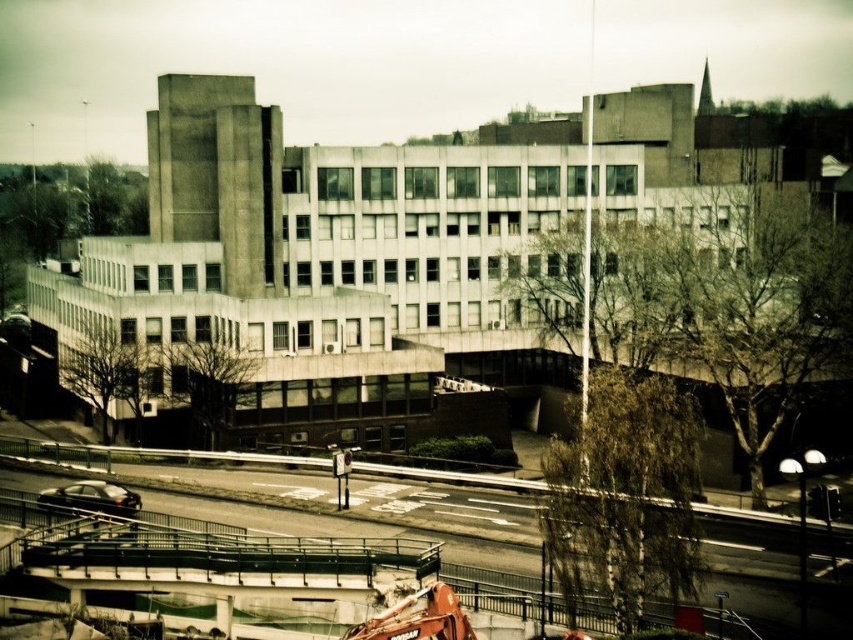
Can you confirm if concrete at center is thinner than orange metallic crane at center?

Incorrect, concrete at center's width is not less than orange metallic crane at center's.

Is concrete at center positioned behind orange metallic crane at center?

Yes, concrete at center is behind orange metallic crane at center.

The image size is (853, 640). Find the location of `concrete at center`. concrete at center is located at coordinates click(433, 269).

Image resolution: width=853 pixels, height=640 pixels. I want to click on concrete at center, so click(x=433, y=269).